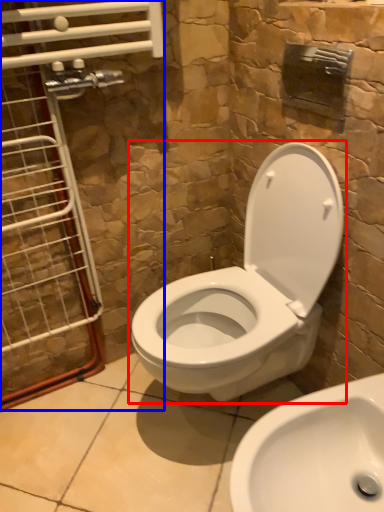
Question: Which object is further to the camera taking this photo, toilet (highlighted by a red box) or glass door (highlighted by a blue box)?

Choices:
 (A) toilet
 (B) glass door

Answer: (B)